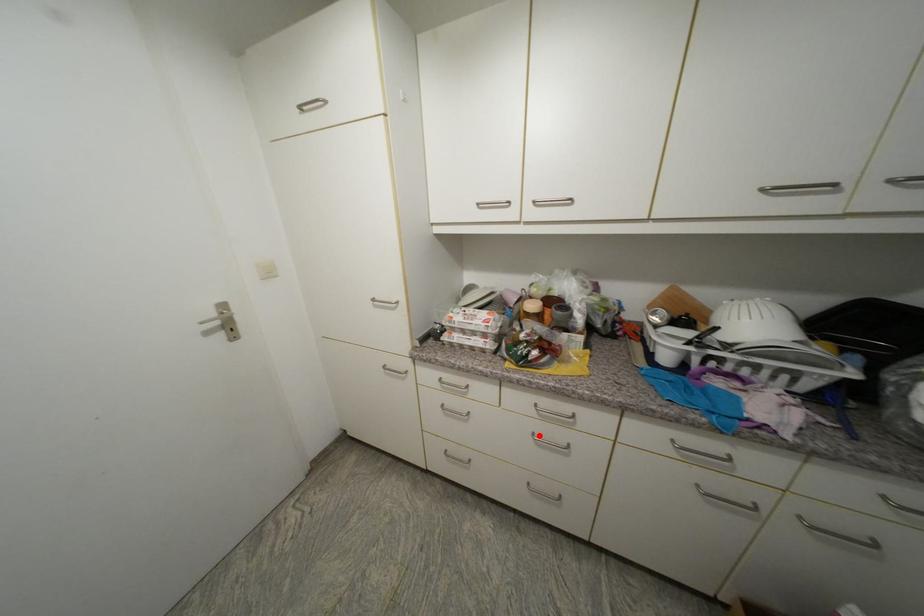
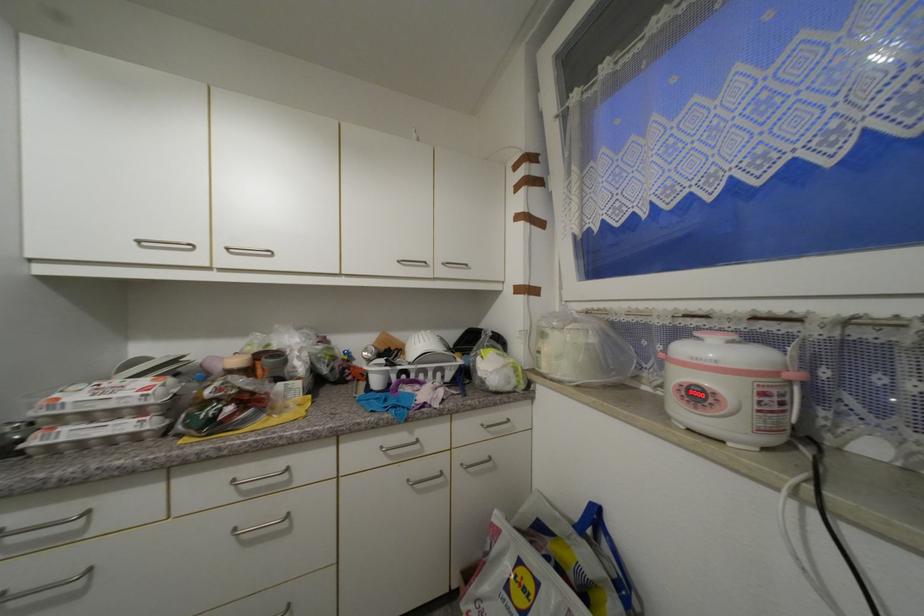
Find the pixel in the second image that matches the highlighted location in the first image.

(240, 531)